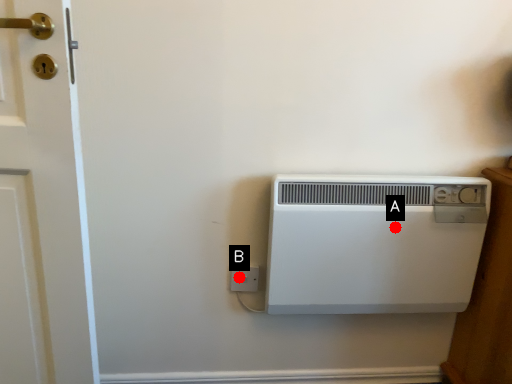
Question: Two points are circled on the image, labeled by A and B beside each circle. Which of the following is the farthest from the observer?

Choices:
 (A) A is further
 (B) B is further

Answer: (B)